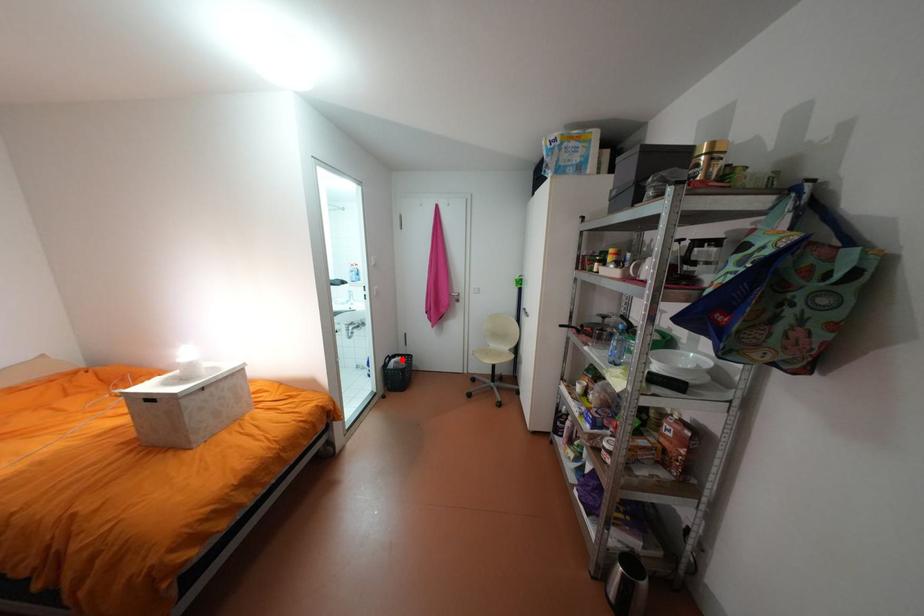
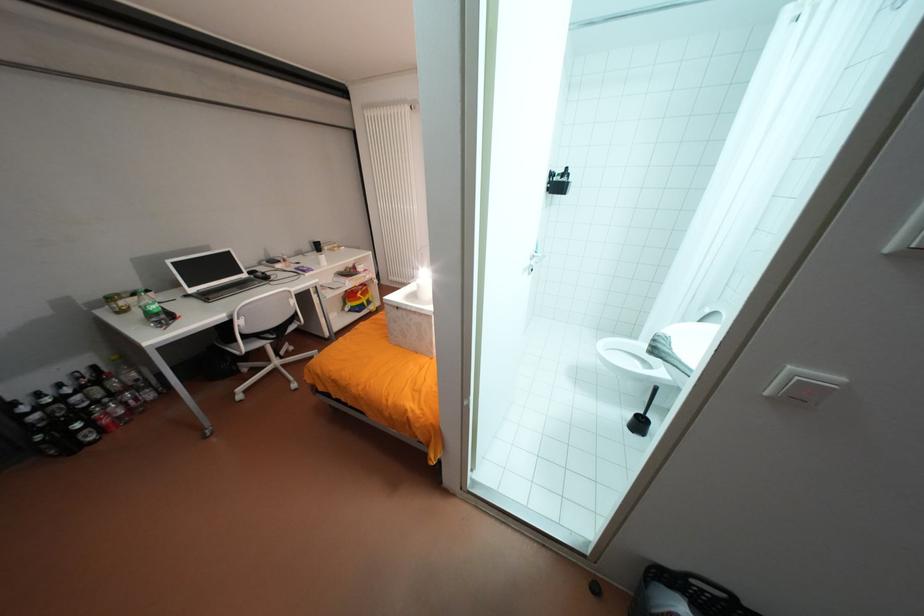
Question: I am providing you with two images of the same scene from different viewpoints. In image1, a red point is highlighted. Considering the same 3D point in image2, which of the following is correct?

Choices:
 (A) It is closer
 (B) It is farther

Answer: (A)